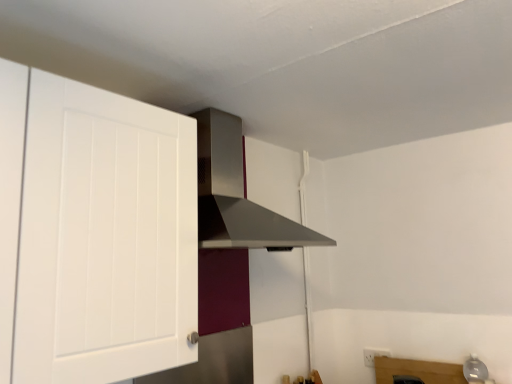
Locate an element on the screen. satin silver vent at upper center is located at coordinates (237, 194).

Measure the distance between point (253, 212) and camera.

A distance of 6.97 feet exists between point (253, 212) and camera.

What do you see at coordinates (237, 194) in the screenshot?
I see `satin silver vent at upper center` at bounding box center [237, 194].

The height and width of the screenshot is (384, 512). Describe the element at coordinates (96, 231) in the screenshot. I see `white matte cabinet at left` at that location.

Where is `white matte cabinet at left`? The image size is (512, 384). white matte cabinet at left is located at coordinates (96, 231).

Find the location of a particular element. Image resolution: width=512 pixels, height=384 pixels. satin silver vent at upper center is located at coordinates coord(237,194).

Considering the positions of objects white matte cabinet at left and satin silver vent at upper center in the image provided, who is more to the left, white matte cabinet at left or satin silver vent at upper center?

Positioned to the left is white matte cabinet at left.

Considering the positions of objects white matte cabinet at left and satin silver vent at upper center in the image provided, who is in front, white matte cabinet at left or satin silver vent at upper center?

Positioned in front is white matte cabinet at left.

Which point is more forward, (38,305) or (236,139)?

Point (38,305)

From the image's perspective, which one is positioned lower, white matte cabinet at left or satin silver vent at upper center?

white matte cabinet at left.

From a real-world perspective, which is physically below, white matte cabinet at left or satin silver vent at upper center?

In real-world perspective, white matte cabinet at left is lower.

Does white matte cabinet at left have a lesser width compared to satin silver vent at upper center?

Correct, the width of white matte cabinet at left is less than that of satin silver vent at upper center.

Based on the photo, who is taller, white matte cabinet at left or satin silver vent at upper center?

With more height is white matte cabinet at left.

Based on their sizes in the image, would you say white matte cabinet at left is bigger or smaller than satin silver vent at upper center?

white matte cabinet at left is smaller than satin silver vent at upper center.

Is satin silver vent at upper center inside white matte cabinet at left?

That's incorrect, satin silver vent at upper center is not inside white matte cabinet at left.

Is white matte cabinet at left placed right next to satin silver vent at upper center?

There is a gap between white matte cabinet at left and satin silver vent at upper center.

Is white matte cabinet at left facing towards satin silver vent at upper center?

No, white matte cabinet at left does not turn towards satin silver vent at upper center.

How many degrees apart are the facing directions of white matte cabinet at left and satin silver vent at upper center?

The angle between the facing direction of white matte cabinet at left and the facing direction of satin silver vent at upper center is 1.49 degrees.

How far apart are white matte cabinet at left and satin silver vent at upper center?

They are 17.64 inches apart.

The width and height of the screenshot is (512, 384). In the image, there is a white matte cabinet at left. Find the location of `vent above it (from the image's perspective)`. vent above it (from the image's perspective) is located at coordinates (237, 194).

Between satin silver vent at upper center and white matte cabinet at left, which one appears on the left side from the viewer's perspective?

white matte cabinet at left is more to the left.

Based on the photo, considering the positions of objects satin silver vent at upper center and white matte cabinet at left in the image provided, who is in front, satin silver vent at upper center or white matte cabinet at left?

Positioned in front is white matte cabinet at left.

Which is closer to the camera, (257, 228) or (150, 362)?

The point (150, 362) is in front.

From the image's perspective, does satin silver vent at upper center appear lower than white matte cabinet at left?

No, from the image's perspective, satin silver vent at upper center is not beneath white matte cabinet at left.

From a real-world perspective, is satin silver vent at upper center over white matte cabinet at left?

Yes, from a real-world perspective, satin silver vent at upper center is over white matte cabinet at left

Considering the sizes of objects satin silver vent at upper center and white matte cabinet at left in the image provided, who is wider, satin silver vent at upper center or white matte cabinet at left?

With larger width is satin silver vent at upper center.

Considering the sizes of objects satin silver vent at upper center and white matte cabinet at left in the image provided, who is shorter, satin silver vent at upper center or white matte cabinet at left?

With less height is satin silver vent at upper center.

Looking at the image, does satin silver vent at upper center seem bigger or smaller compared to white matte cabinet at left?

In the image, satin silver vent at upper center appears to be larger than white matte cabinet at left.

Is satin silver vent at upper center inside or outside of white matte cabinet at left?

satin silver vent at upper center is spatially situated outside white matte cabinet at left.

Is satin silver vent at upper center far from white matte cabinet at left?

They are positioned close to each other.

Does satin silver vent at upper center turn towards white matte cabinet at left?

No, satin silver vent at upper center is not turned towards white matte cabinet at left.

Can you tell me how much satin silver vent at upper center and white matte cabinet at left differ in facing direction?

satin silver vent at upper center and white matte cabinet at left are facing 1.49 degrees away from each other.

The height and width of the screenshot is (384, 512). Identify the location of cabinetry below the satin silver vent at upper center (from the image's perspective). (96, 231).

Where is `vent that appears behind the white matte cabinet at left`? vent that appears behind the white matte cabinet at left is located at coordinates (237, 194).

You are a GUI agent. You are given a task and a screenshot of the screen. Output one action in this format:
    pyautogui.click(x=<x>, y=<y>)
    Task: Click on the cabinetry below the satin silver vent at upper center (from a real-world perspective)
    
    Given the screenshot: What is the action you would take?
    pos(96,231)